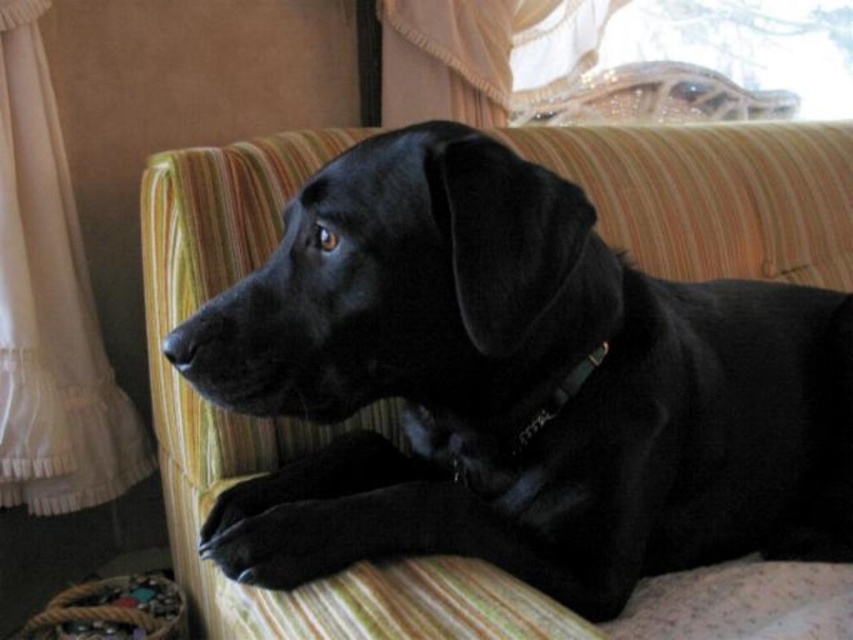
Does point (347, 460) come farther from viewer compared to point (28, 150)?

That is False.

Which is behind, point (207, 538) or point (122, 424)?

Positioned behind is point (122, 424).

The height and width of the screenshot is (640, 853). I want to click on shiny black dog at center, so click(515, 385).